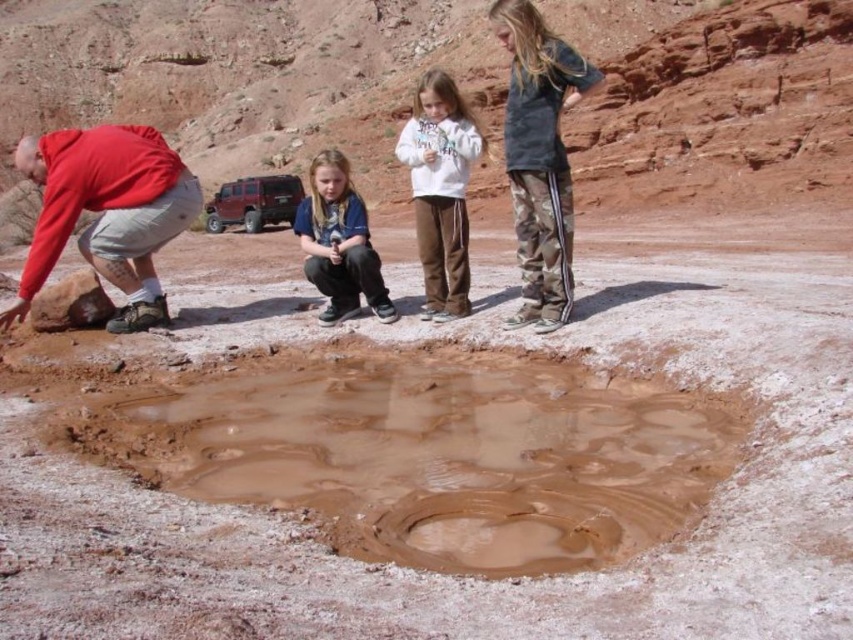
You are a hiker in the desert and need to cross the area where the muddy wet puddle at center and camo pants at right are located. Which object should you avoid stepping on to prevent sinking?

You should avoid stepping on the muddy wet puddle at center because it is larger and more likely to be deeper, causing you to sink. The camo pants at right are solid ground and safe to step on.

You are a hiker in the desert and see the muddy wet puddle at center and the white fleece jacket at center. Which object is closer to the ground?

The muddy wet puddle at center is closer to the ground because it is located below the white fleece jacket at center.

You are a photographer standing at the edge of the muddy pool. You want to take a photo that includes both the camo pants at right and the blue denim jacket at center. How far apart are these two objects in the scene?

The camo pants at right is 34.55 feet away from the blue denim jacket at center, so they are 34.55 feet apart in the scene.